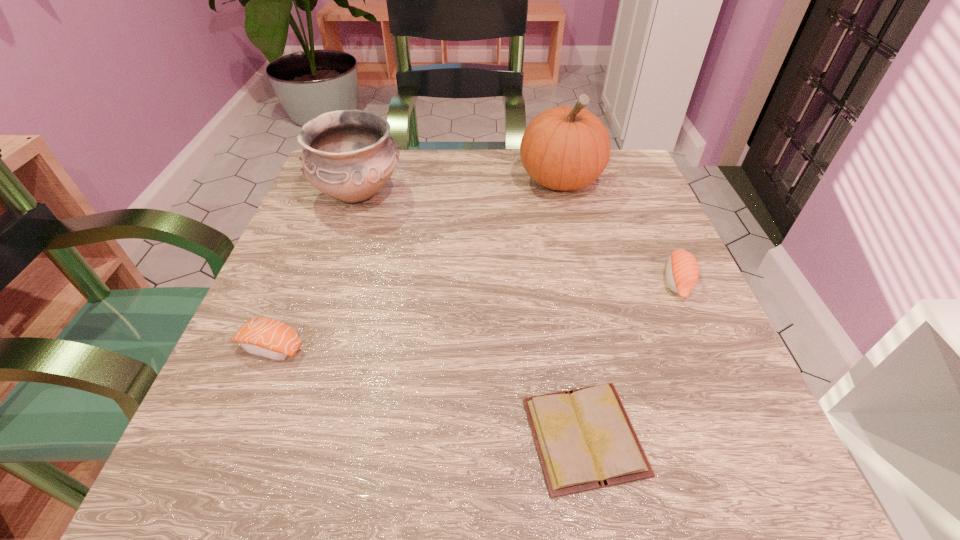
The image size is (960, 540). I want to click on vacant space located 0.210m on the left of the third farthest object, so click(545, 282).

This screenshot has width=960, height=540. Find the location of `free space located on the front of the second shortest object`. free space located on the front of the second shortest object is located at coordinates (250, 399).

Locate an element on the screen. vacant area located on the left of the nearest object is located at coordinates click(x=435, y=436).

Where is `pumpkin at the far edge`? pumpkin at the far edge is located at coordinates (564, 148).

Identify the location of pottery that is positioned at the far edge. (348, 155).

Identify the location of object that is at the near edge. The image size is (960, 540). (584, 438).

Locate an element on the screen. The width and height of the screenshot is (960, 540). pottery positioned at the left edge is located at coordinates (348, 155).

In order to click on sushi at the left edge in this screenshot , I will do click(269, 338).

Image resolution: width=960 pixels, height=540 pixels. Identify the location of pumpkin at the right edge. (564, 148).

Find the location of a particular element. This screenshot has width=960, height=540. sushi present at the right edge is located at coordinates (682, 272).